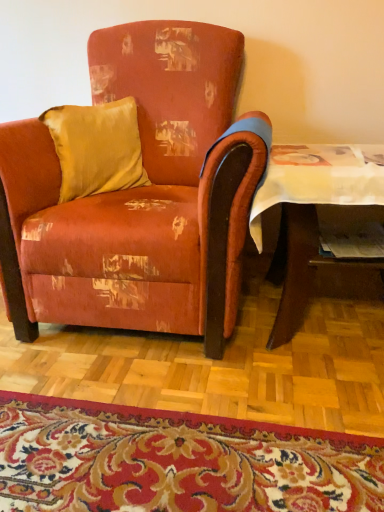
Question: Is wooden table at lower right positioned behind carpet with floral pattern at lower center?

Choices:
 (A) no
 (B) yes

Answer: (B)

Question: Does wooden table at lower right turn towards carpet with floral pattern at lower center?

Choices:
 (A) no
 (B) yes

Answer: (A)

Question: Considering the relative sizes of wooden table at lower right and carpet with floral pattern at lower center in the image provided, is wooden table at lower right taller than carpet with floral pattern at lower center?

Choices:
 (A) no
 (B) yes

Answer: (B)

Question: From the image's perspective, is wooden table at lower right on top of carpet with floral pattern at lower center?

Choices:
 (A) yes
 (B) no

Answer: (A)

Question: Is wooden table at lower right facing away from carpet with floral pattern at lower center?

Choices:
 (A) no
 (B) yes

Answer: (A)

Question: Is carpet with floral pattern at lower center inside the boundaries of matte paper magazine at lower right, or outside?

Choices:
 (A) inside
 (B) outside

Answer: (B)

Question: Looking at the image, does carpet with floral pattern at lower center seem bigger or smaller compared to matte paper magazine at lower right?

Choices:
 (A) small
 (B) big

Answer: (B)

Question: Visually, is carpet with floral pattern at lower center positioned to the left or to the right of matte paper magazine at lower right?

Choices:
 (A) right
 (B) left

Answer: (B)

Question: Considering the positions of point [19, 404] and point [379, 239], is point [19, 404] closer or farther from the camera than point [379, 239]?

Choices:
 (A) farther
 (B) closer

Answer: (B)

Question: In the image, is satin gold pillow at upper left positioned in front of or behind carpet with floral pattern at lower center?

Choices:
 (A) behind
 (B) front

Answer: (A)

Question: Choose the correct answer: Is satin gold pillow at upper left inside carpet with floral pattern at lower center or outside it?

Choices:
 (A) outside
 (B) inside

Answer: (A)

Question: Considering the positions of satin gold pillow at upper left and carpet with floral pattern at lower center in the image, is satin gold pillow at upper left bigger or smaller than carpet with floral pattern at lower center?

Choices:
 (A) big
 (B) small

Answer: (A)

Question: From a real-world perspective, is satin gold pillow at upper left physically located above or below carpet with floral pattern at lower center?

Choices:
 (A) below
 (B) above

Answer: (B)

Question: Is wooden table at lower right inside or outside of satin gold pillow at upper left?

Choices:
 (A) outside
 (B) inside

Answer: (A)

Question: Based on their sizes in the image, would you say wooden table at lower right is bigger or smaller than satin gold pillow at upper left?

Choices:
 (A) small
 (B) big

Answer: (B)